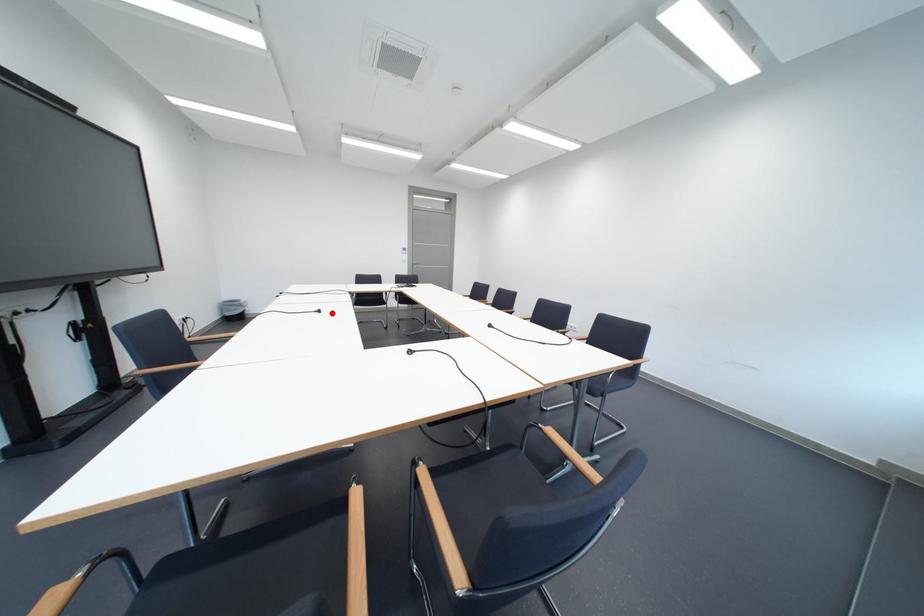
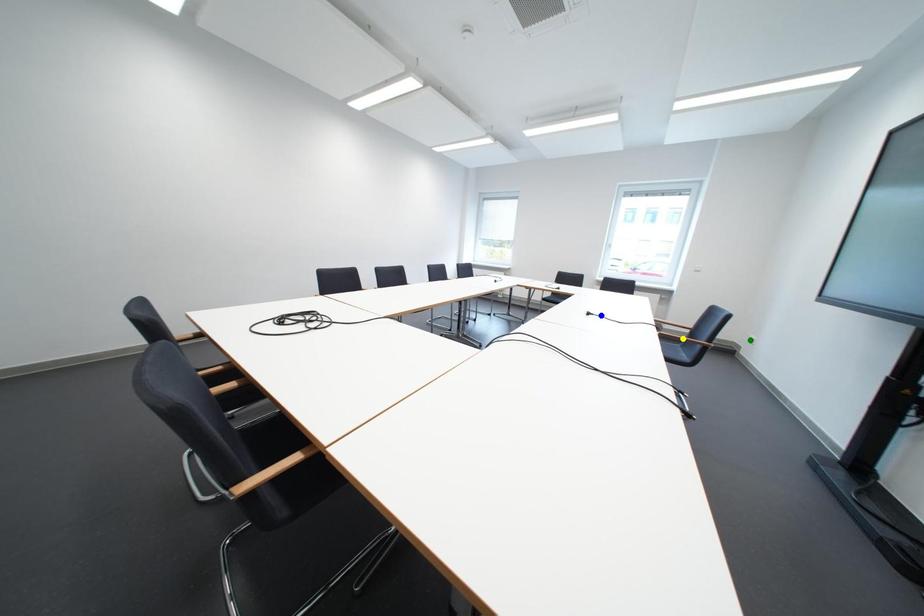
Question: I am providing you with two images of the same scene from different viewpoints. A red point is marked on the first image. You are given multiple points on the second image. In image 2, which mark is for the same physical point as the one in image 1?

Choices:
 (A) green point
 (B) blue point
 (C) yellow point

Answer: (B)